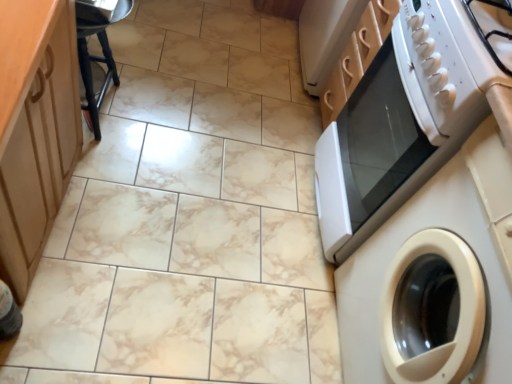
Where is `white glossy gas stove at upper right`? This screenshot has height=384, width=512. white glossy gas stove at upper right is located at coordinates (454, 64).

The height and width of the screenshot is (384, 512). In order to click on black plastic bar stool at upper left in this screenshot , I will do `click(97, 56)`.

You are a GUI agent. You are given a task and a screenshot of the screen. Output one action in this format:
    pyautogui.click(x=<x>, y=<y>)
    Task: Click on the white glossy microwave at upper right
    The height and width of the screenshot is (384, 512).
    Given the screenshot: What is the action you would take?
    pyautogui.click(x=407, y=116)

Which of these two, white glossy washing machine at right or white glossy gas stove at upper right, is bigger?

Bigger between the two is white glossy washing machine at right.

Does white glossy washing machine at right contain white glossy gas stove at upper right?

No, white glossy washing machine at right does not contain white glossy gas stove at upper right.

Is white glossy washing machine at right taller than white glossy gas stove at upper right?

Correct, white glossy washing machine at right is much taller as white glossy gas stove at upper right.

Identify the location of gas stove above the white glossy washing machine at right (from the image's perspective). This screenshot has height=384, width=512. (454, 64).

Is white glossy microwave at upper right positioned behind white glossy washing machine at right?

That is True.

Are white glossy microwave at upper right and white glossy washing machine at right located far from each other?

white glossy microwave at upper right is actually quite close to white glossy washing machine at right.

Which is nearer, (x=357, y=242) or (x=485, y=173)?

Point (x=357, y=242) is positioned farther from the camera compared to point (x=485, y=173).

Based on their sizes in the image, would you say white glossy microwave at upper right is bigger or smaller than white glossy washing machine at right?

Clearly, white glossy microwave at upper right is smaller in size than white glossy washing machine at right.

Can you confirm if black plastic bar stool at upper left is taller than white glossy microwave at upper right?

No, black plastic bar stool at upper left is not taller than white glossy microwave at upper right.

Looking at this image, considering the sizes of black plastic bar stool at upper left and white glossy microwave at upper right in the image, is black plastic bar stool at upper left bigger or smaller than white glossy microwave at upper right?

Clearly, black plastic bar stool at upper left is smaller in size than white glossy microwave at upper right.

From a real-world perspective, is white glossy gas stove at upper right positioned under white glossy washing machine at right based on gravity?

No, from a real-world perspective, white glossy gas stove at upper right is not below white glossy washing machine at right.

Does white glossy gas stove at upper right have a greater height compared to white glossy washing machine at right?

No, white glossy gas stove at upper right is not taller than white glossy washing machine at right.

Is white glossy washing machine at right a part of white glossy gas stove at upper right?

No, white glossy washing machine at right is not inside white glossy gas stove at upper right.

Considering the sizes of objects white glossy gas stove at upper right and white glossy washing machine at right in the image provided, who is smaller, white glossy gas stove at upper right or white glossy washing machine at right?

Smaller between the two is white glossy gas stove at upper right.

Between white glossy gas stove at upper right and black plastic bar stool at upper left, which one has more height?

black plastic bar stool at upper left.

Is black plastic bar stool at upper left a part of white glossy gas stove at upper right?

No, black plastic bar stool at upper left is not surrounded by white glossy gas stove at upper right.

From the picture: Could you tell me if white glossy gas stove at upper right is facing black plastic bar stool at upper left?

No, white glossy gas stove at upper right is not oriented towards black plastic bar stool at upper left.

From a real-world perspective, is white glossy gas stove at upper right located higher than black plastic bar stool at upper left?

Correct, in the physical world, white glossy gas stove at upper right is higher than black plastic bar stool at upper left.

From the image's perspective, between black plastic bar stool at upper left and white glossy gas stove at upper right, who is located below?

white glossy gas stove at upper right appears lower in the image.

At what (x,y) coordinates should I click in order to perform the action: click on bar stool on the left of white glossy gas stove at upper right. Please return your answer as a coordinate pair (x, y). The image size is (512, 384). Looking at the image, I should click on (97, 56).

Between black plastic bar stool at upper left and white glossy gas stove at upper right, which one has smaller width?

Thinner between the two is black plastic bar stool at upper left.

Does black plastic bar stool at upper left contain white glossy washing machine at right?

That's incorrect, white glossy washing machine at right is not inside black plastic bar stool at upper left.

Which object is more forward, black plastic bar stool at upper left or white glossy washing machine at right?

white glossy washing machine at right.

You are a GUI agent. You are given a task and a screenshot of the screen. Output one action in this format:
    pyautogui.click(x=<x>, y=<y>)
    Task: Click on the washing machine that appears below the black plastic bar stool at upper left (from the image's perspective)
    The image size is (512, 384).
    Given the screenshot: What is the action you would take?
    pyautogui.click(x=448, y=263)

The height and width of the screenshot is (384, 512). I want to click on gas stove behind the white glossy washing machine at right, so pos(454,64).

Identify the location of washing machine lying below the white glossy microwave at upper right (from the image's perspective). This screenshot has height=384, width=512. (448, 263).

Which object lies further to the anchor point white glossy washing machine at right, white glossy gas stove at upper right or white glossy microwave at upper right?

Among the two, white glossy gas stove at upper right is located further to white glossy washing machine at right.

Which object lies nearer to the anchor point white glossy washing machine at right, white glossy microwave at upper right or black plastic bar stool at upper left?

white glossy microwave at upper right is positioned closer to the anchor white glossy washing machine at right.

From the image, which object appears to be farther from white glossy washing machine at right, white glossy gas stove at upper right or black plastic bar stool at upper left?

black plastic bar stool at upper left.

From the image, which object appears to be farther from white glossy gas stove at upper right, black plastic bar stool at upper left or white glossy washing machine at right?

black plastic bar stool at upper left is further to white glossy gas stove at upper right.

Which object lies further to the anchor point white glossy microwave at upper right, white glossy gas stove at upper right or black plastic bar stool at upper left?

Based on the image, black plastic bar stool at upper left appears to be further to white glossy microwave at upper right.

From the image, which object appears to be nearer to black plastic bar stool at upper left, white glossy microwave at upper right or white glossy washing machine at right?

The object closer to black plastic bar stool at upper left is white glossy microwave at upper right.

When comparing their distances from black plastic bar stool at upper left, does white glossy washing machine at right or white glossy gas stove at upper right seem closer?

white glossy gas stove at upper right.

Considering their positions, is white glossy washing machine at right positioned closer to white glossy gas stove at upper right than black plastic bar stool at upper left?

Based on the image, white glossy washing machine at right appears to be nearer to white glossy gas stove at upper right.

In order to click on gas stove between black plastic bar stool at upper left and white glossy washing machine at right in this screenshot , I will do `click(454, 64)`.

The width and height of the screenshot is (512, 384). Find the location of `home appliance between black plastic bar stool at upper left and white glossy gas stove at upper right`. home appliance between black plastic bar stool at upper left and white glossy gas stove at upper right is located at coordinates (407, 116).

Locate an element on the screen. This screenshot has width=512, height=384. home appliance between black plastic bar stool at upper left and white glossy washing machine at right from left to right is located at coordinates (x=407, y=116).

The image size is (512, 384). I want to click on home appliance that lies between white glossy gas stove at upper right and white glossy washing machine at right from top to bottom, so click(407, 116).